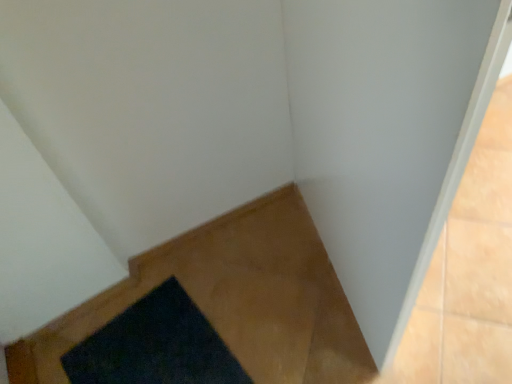
Identify the location of dark blue carpet at lower left. This screenshot has width=512, height=384. (155, 346).

Describe the element at coordinates (155, 346) in the screenshot. This screenshot has height=384, width=512. I see `dark blue carpet at lower left` at that location.

Measure the distance between point (211, 337) and camera.

Point (211, 337) and camera are 1.24 meters apart.

You are a GUI agent. You are given a task and a screenshot of the screen. Output one action in this format:
    pyautogui.click(x=<x>, y=<y>)
    Task: Click on the dark blue carpet at lower left
    
    Given the screenshot: What is the action you would take?
    pyautogui.click(x=155, y=346)